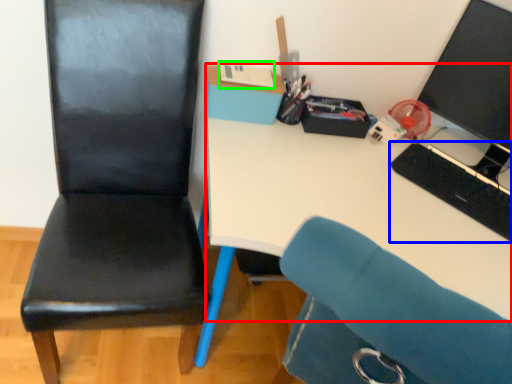
Question: Considering the real-world distances, which object is farthest from desk (highlighted by a red box)? keyboard (highlighted by a blue box) or stationery (highlighted by a green box)?

Choices:
 (A) keyboard
 (B) stationery

Answer: (B)